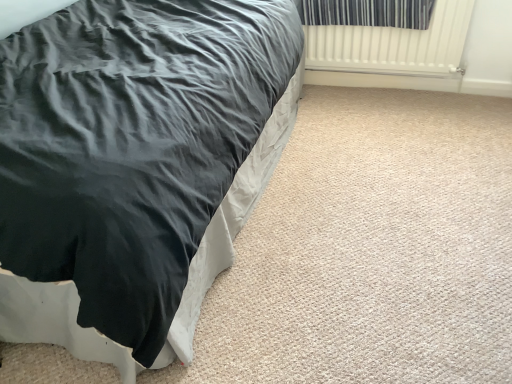
Question: Is point [397, 6] positioned closer to the camera than point [182, 211]?

Choices:
 (A) farther
 (B) closer

Answer: (A)

Question: Would you say striped fabric curtain at upper right is to the left or to the right of black satin bed at left in the picture?

Choices:
 (A) right
 (B) left

Answer: (A)

Question: Which of these objects is positioned closest to the white ribbed radiator at upper right?

Choices:
 (A) black satin bed at left
 (B) striped fabric curtain at upper right

Answer: (B)

Question: Which object is the closest to the white ribbed radiator at upper right?

Choices:
 (A) striped fabric curtain at upper right
 (B) black satin bed at left

Answer: (A)